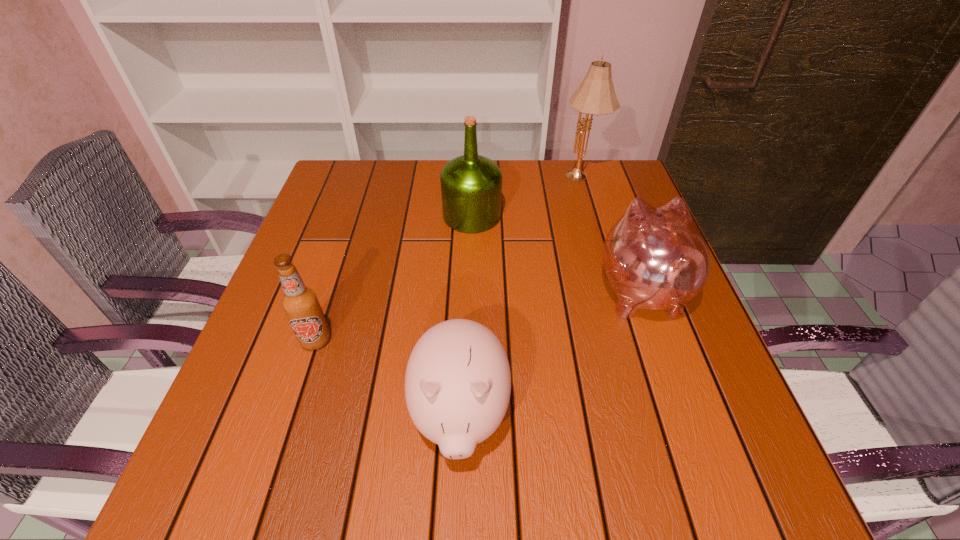
What are the coordinates of `blank space located 0.130m on the front label of the leftmost object` in the screenshot? It's located at (291, 417).

At what (x,y) coordinates should I click in order to perform the action: click on free space located 0.340m on the front facing side of the right piggy bank. Please return your answer as a coordinate pair (x, y). Looking at the image, I should click on (601, 176).

I want to click on vacant area situated 0.170m on the front facing side of the right piggy bank, so click(613, 211).

Locate an element on the screen. vacant space positioned 0.100m on the front facing side of the right piggy bank is located at coordinates (619, 228).

The height and width of the screenshot is (540, 960). Identify the location of lampshade present at the far edge. (596, 95).

At what (x,y) coordinates should I click in order to perform the action: click on olive oil that is positioned at the far edge. Please return your answer as a coordinate pair (x, y). This screenshot has height=540, width=960. Looking at the image, I should click on (471, 185).

Identify the location of object that is at the near edge. This screenshot has width=960, height=540. (458, 382).

Where is `object that is at the left edge`? object that is at the left edge is located at coordinates (300, 303).

The width and height of the screenshot is (960, 540). I want to click on lampshade that is at the right edge, so click(596, 95).

Find the location of a particular element. This screenshot has height=540, width=960. piggy bank at the right edge is located at coordinates [x=655, y=258].